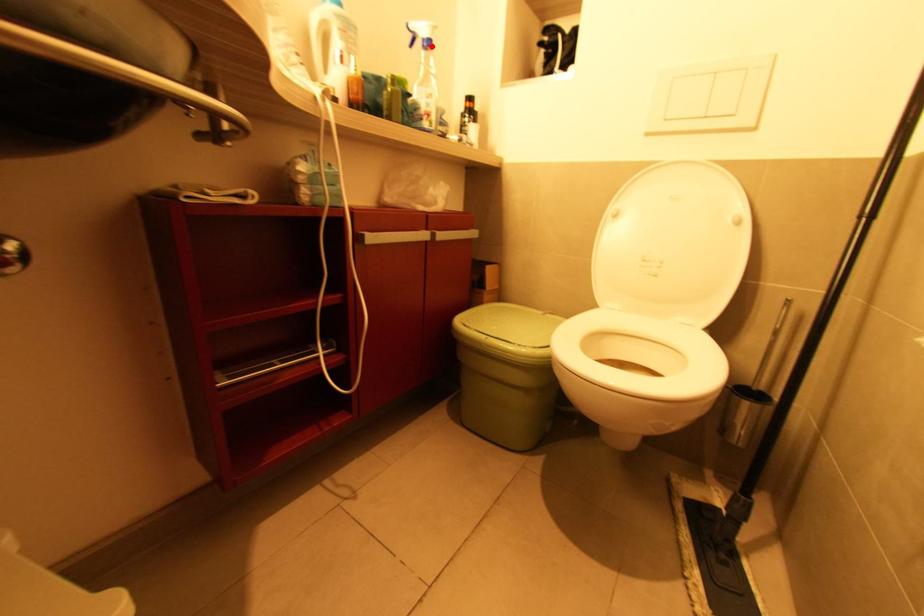
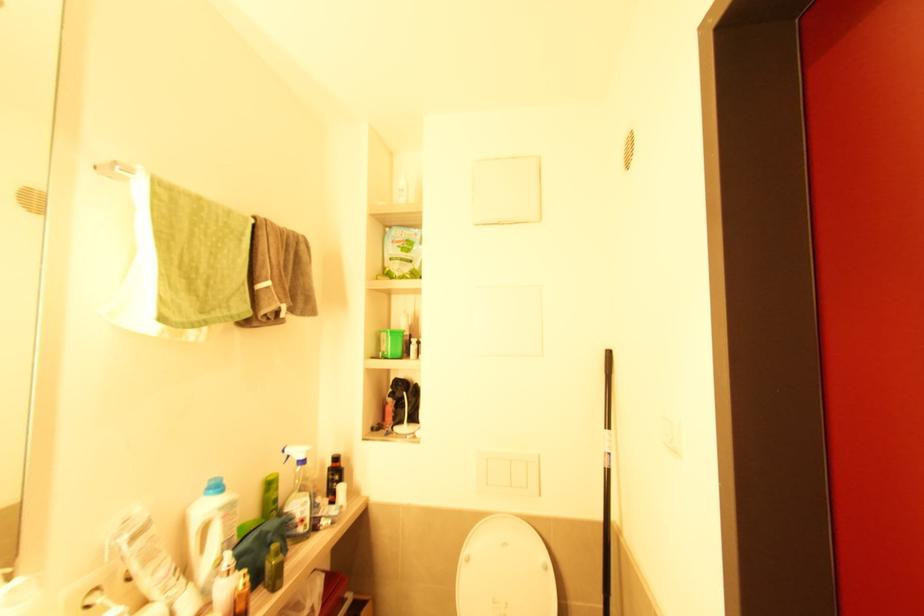
Find the pixel in the second image that matches the highlighted location in the first image.

(305, 462)